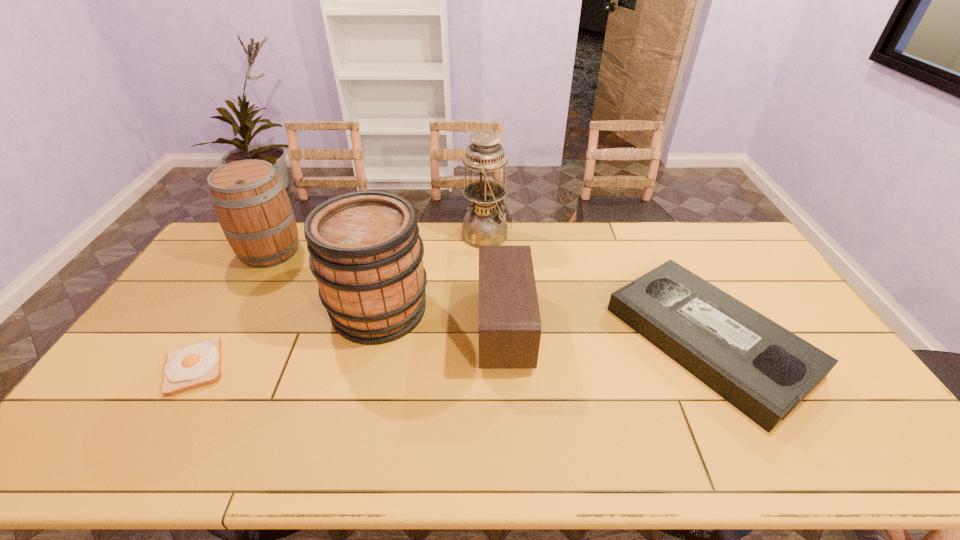
Where is `vacant space located 0.170m on the right of the left cider`? vacant space located 0.170m on the right of the left cider is located at coordinates (348, 251).

Find the location of a particular element. free space located on the front-facing side of the radio receiver is located at coordinates (396, 328).

Locate an element on the screen. free space located 0.170m on the front-facing side of the radio receiver is located at coordinates (422, 328).

Where is `vacant space positioned on the front-facing side of the radio receiver`? This screenshot has height=540, width=960. vacant space positioned on the front-facing side of the radio receiver is located at coordinates (348, 328).

Where is `free location located on the back of the videotape`? The image size is (960, 540). free location located on the back of the videotape is located at coordinates tap(659, 244).

Identify the location of vacant area situated on the right of the shortest object. (328, 367).

Locate an element on the screen. oil lamp that is at the far edge is located at coordinates (485, 224).

Where is `cider located in the far edge section of the desktop`? cider located in the far edge section of the desktop is located at coordinates (252, 206).

Where is `object that is positioned at the near edge`? This screenshot has width=960, height=540. object that is positioned at the near edge is located at coordinates (764, 370).

I want to click on cider positioned at the left edge, so click(252, 206).